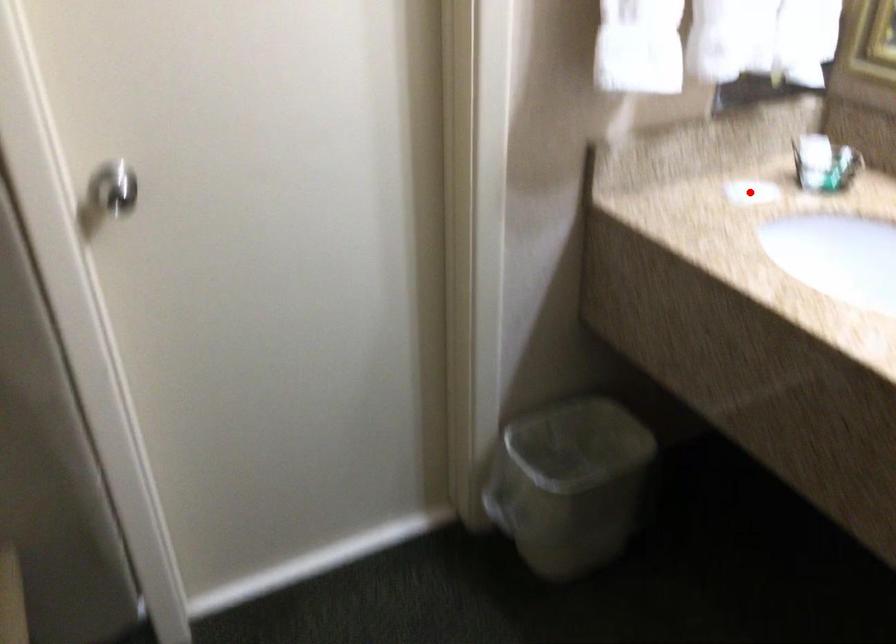
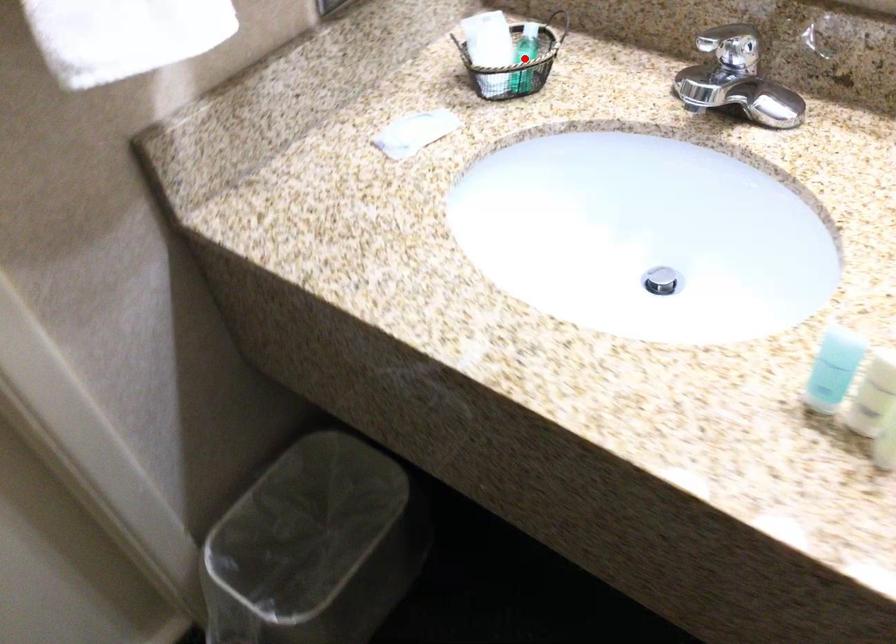
I am providing you with two images of the same scene from different viewpoints. A red point is marked on the first image and another point is marked on the second image. Is the marked point in image1 the same physical position as the marked point in image2?

No